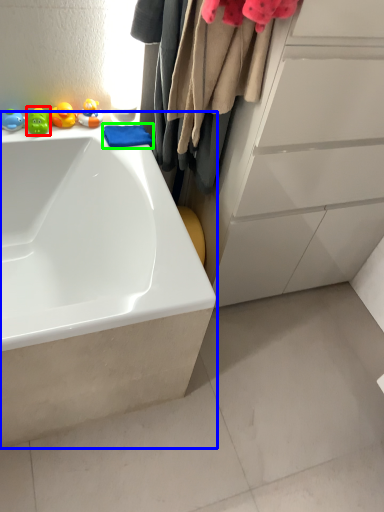
Question: Which is farther away from toy (highlighted by a red box)? bathtub (highlighted by a blue box) or baby clothe (highlighted by a green box)?

Choices:
 (A) bathtub
 (B) baby clothe

Answer: (A)